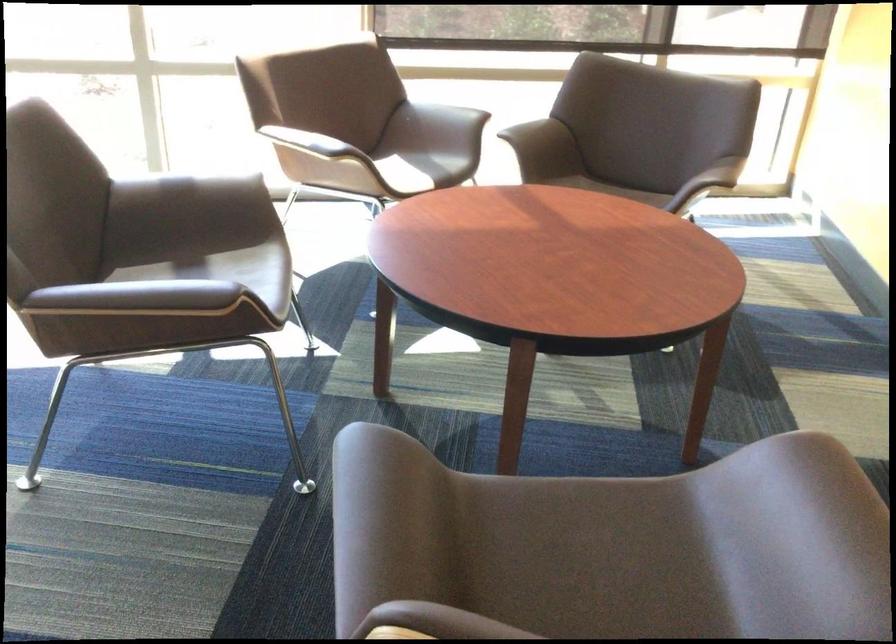
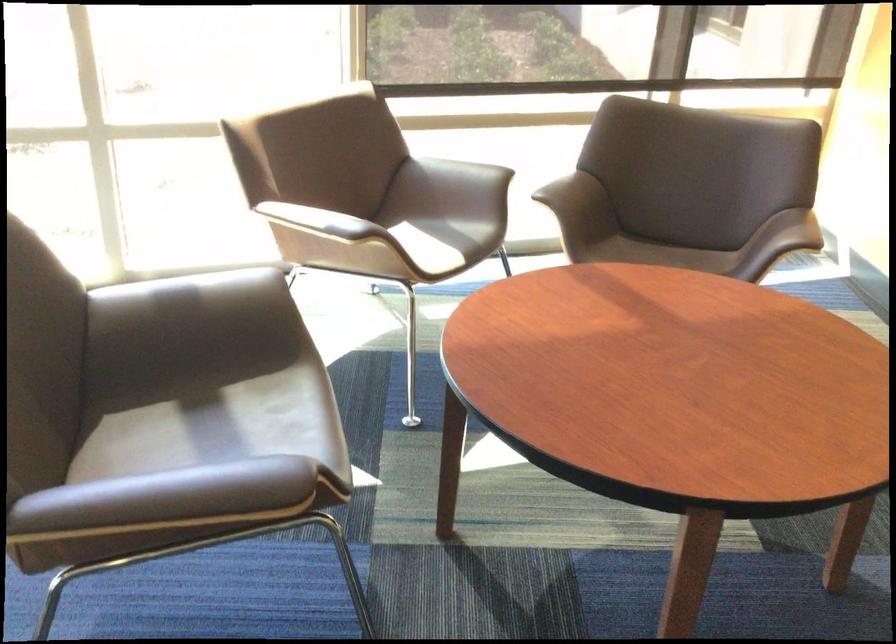
Question: Based on the continuous images, in which direction is the camera rotating? Reply with the corresponding letter.

Choices:
 (A) Left
 (B) Right
 (C) Up
 (D) Down

Answer: (B)